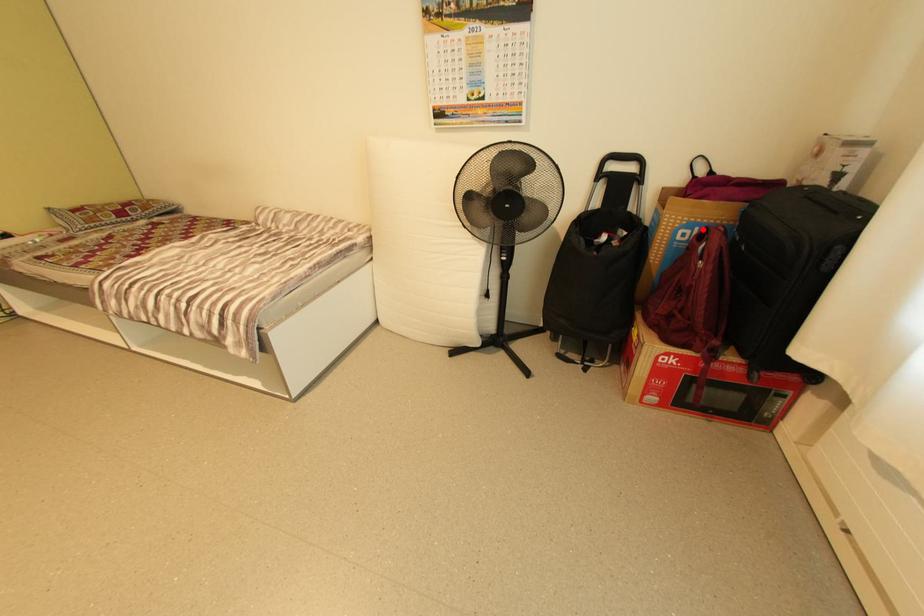
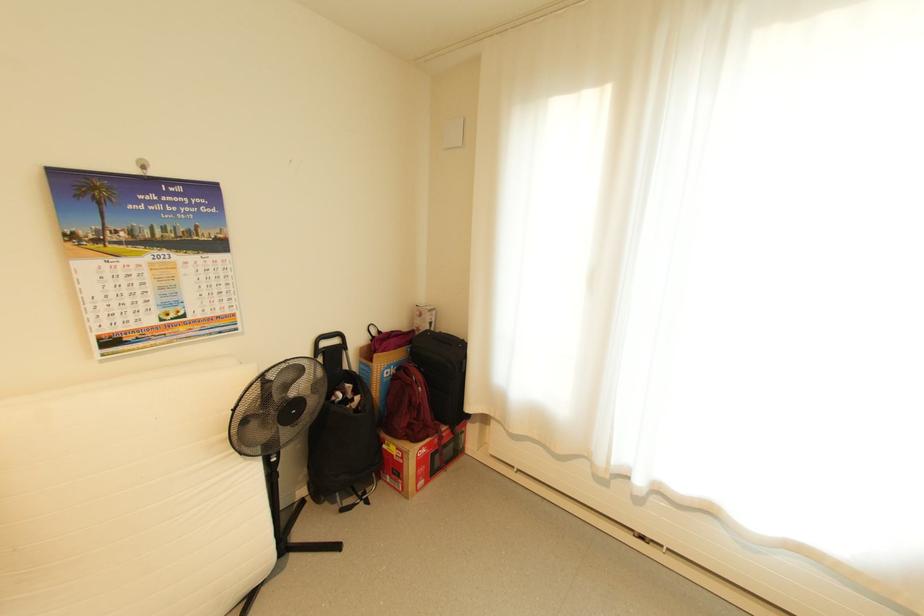
Find the pixel in the second image that matches the highlighted location in the first image.

(398, 368)